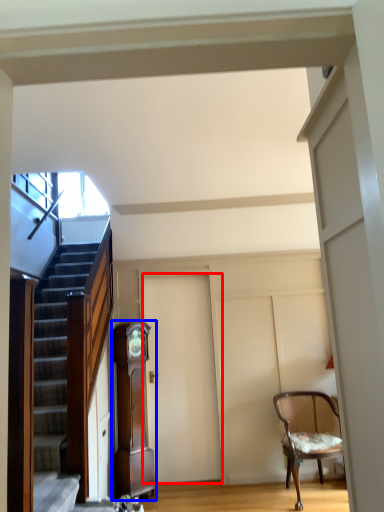
Question: Which object appears farthest to the camera in this image, door (highlighted by a red box) or cabinetry (highlighted by a blue box)?

Choices:
 (A) door
 (B) cabinetry

Answer: (A)